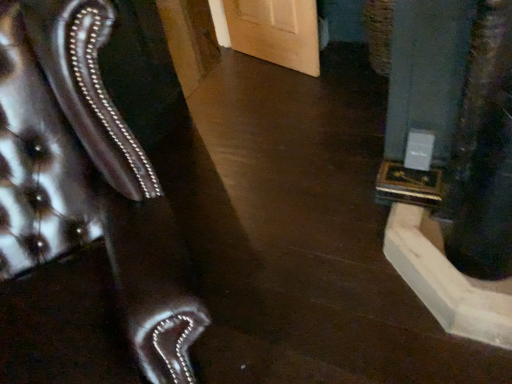
This screenshot has height=384, width=512. What do you see at coordinates (426, 72) in the screenshot?
I see `gray concrete pillar at right` at bounding box center [426, 72].

Image resolution: width=512 pixels, height=384 pixels. In order to click on gray concrete pillar at right in this screenshot , I will do `click(426, 72)`.

Find the location of a particular element. leather-like brown armchair at left is located at coordinates (87, 179).

The image size is (512, 384). Describe the element at coordinates (87, 179) in the screenshot. I see `leather-like brown armchair at left` at that location.

You are a GUI agent. You are given a task and a screenshot of the screen. Output one action in this format:
    pyautogui.click(x=<x>, y=<y>)
    Task: Click on the gray concrete pillar at right
    The height and width of the screenshot is (384, 512).
    Given the screenshot: What is the action you would take?
    pyautogui.click(x=426, y=72)

Considering the relative positions of gray concrete pillar at right and leather-like brown armchair at left in the image provided, is gray concrete pillar at right to the left of leather-like brown armchair at left from the viewer's perspective?

In fact, gray concrete pillar at right is to the right of leather-like brown armchair at left.

Who is more distant, gray concrete pillar at right or leather-like brown armchair at left?

gray concrete pillar at right is further away from the camera.

Between point (429, 74) and point (15, 236), which one is positioned behind?

The point (429, 74) is farther.

From the image's perspective, which one is positioned lower, gray concrete pillar at right or leather-like brown armchair at left?

From the image's view, leather-like brown armchair at left is below.

From a real-world perspective, is gray concrete pillar at right physically located above or below leather-like brown armchair at left?

gray concrete pillar at right is below leather-like brown armchair at left.

Looking at their sizes, would you say gray concrete pillar at right is wider or thinner than leather-like brown armchair at left?

Considering their sizes, gray concrete pillar at right looks slimmer than leather-like brown armchair at left.

Between gray concrete pillar at right and leather-like brown armchair at left, which one has more height?

Standing taller between the two is leather-like brown armchair at left.

In terms of size, does gray concrete pillar at right appear bigger or smaller than leather-like brown armchair at left?

Clearly, gray concrete pillar at right is smaller in size than leather-like brown armchair at left.

Is gray concrete pillar at right outside of leather-like brown armchair at left?

gray concrete pillar at right is positioned outside leather-like brown armchair at left.

Is gray concrete pillar at right not close to leather-like brown armchair at left?

No, gray concrete pillar at right is in close proximity to leather-like brown armchair at left.

Is gray concrete pillar at right facing towards leather-like brown armchair at left?

No.

How much distance is there between gray concrete pillar at right and leather-like brown armchair at left?

gray concrete pillar at right and leather-like brown armchair at left are 35.89 inches apart from each other.

Identify the location of pillar above the leather-like brown armchair at left (from the image's perspective). (426, 72).

Which is more to the left, leather-like brown armchair at left or gray concrete pillar at right?

leather-like brown armchair at left is more to the left.

Between leather-like brown armchair at left and gray concrete pillar at right, which one is positioned in front?

Positioned in front is leather-like brown armchair at left.

Considering the points (97, 195) and (433, 56), which point is behind, point (97, 195) or point (433, 56)?

Point (433, 56)

From the image's perspective, would you say leather-like brown armchair at left is shown under gray concrete pillar at right?

Indeed, from the image's perspective, leather-like brown armchair at left is shown beneath gray concrete pillar at right.

From a real-world perspective, who is located higher, leather-like brown armchair at left or gray concrete pillar at right?

leather-like brown armchair at left.

Looking at this image, considering the sizes of leather-like brown armchair at left and gray concrete pillar at right in the image, is leather-like brown armchair at left wider or thinner than gray concrete pillar at right?

leather-like brown armchair at left is wider than gray concrete pillar at right.

Between leather-like brown armchair at left and gray concrete pillar at right, which one has less height?

With less height is gray concrete pillar at right.

Based on their sizes in the image, would you say leather-like brown armchair at left is bigger or smaller than gray concrete pillar at right?

In the image, leather-like brown armchair at left appears to be larger than gray concrete pillar at right.

Is leather-like brown armchair at left not within gray concrete pillar at right?

Yes, leather-like brown armchair at left is not within gray concrete pillar at right.

From the picture: Is leather-like brown armchair at left touching gray concrete pillar at right?

leather-like brown armchair at left and gray concrete pillar at right are clearly separated.

Is leather-like brown armchair at left facing away from gray concrete pillar at right?

That's not correct — leather-like brown armchair at left is not looking away from gray concrete pillar at right.

Identify the location of furniture in front of the gray concrete pillar at right. (87, 179).

The height and width of the screenshot is (384, 512). What are the coordinates of `furniture below the gray concrete pillar at right (from the image's perspective)` in the screenshot? It's located at (87, 179).

The height and width of the screenshot is (384, 512). In order to click on furniture that appears on the left of gray concrete pillar at right in this screenshot , I will do [87, 179].